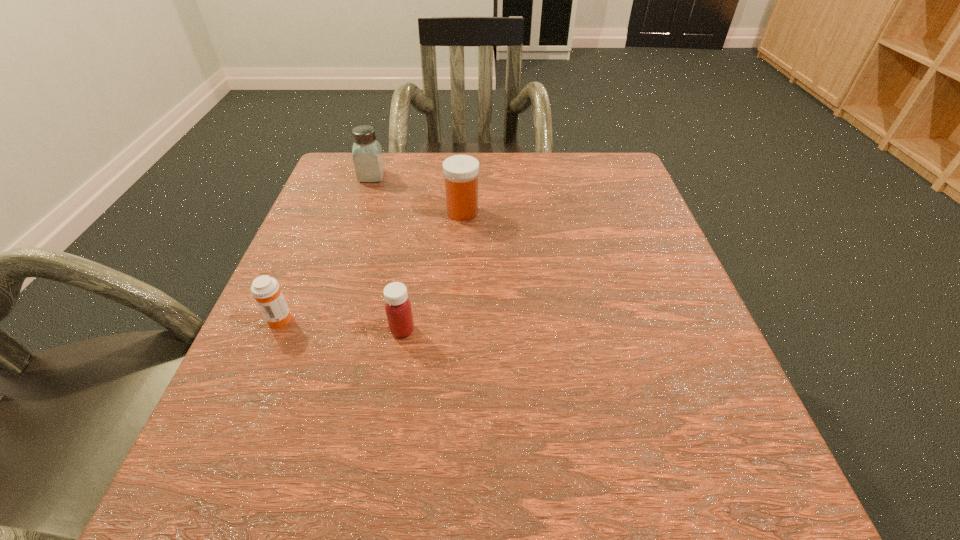
Find the location of a particular element. The width and height of the screenshot is (960, 540). saltshaker that is positioned at the far edge is located at coordinates (368, 160).

Identify the location of medicine that is at the far edge. The height and width of the screenshot is (540, 960). (461, 172).

I want to click on saltshaker present at the left edge, so click(368, 160).

Identify the location of medicine that is at the left edge. The width and height of the screenshot is (960, 540). tap(265, 289).

The image size is (960, 540). Identify the location of object that is at the far left corner. (368, 160).

What are the coordinates of `vacant area at the far edge` in the screenshot? It's located at (414, 156).

What are the coordinates of `vacant space at the near edge of the desktop` in the screenshot? It's located at (565, 510).

Image resolution: width=960 pixels, height=540 pixels. What are the coordinates of `free space at the left edge` in the screenshot? It's located at click(224, 444).

At what (x,y) coordinates should I click in order to perform the action: click on vacant region at the right edge of the desktop. Please return your answer as a coordinate pair (x, y). The width and height of the screenshot is (960, 540). Looking at the image, I should click on click(627, 315).

In the image, there is a desktop. In order to click on blank space at the far left corner in this screenshot , I will do `click(345, 153)`.